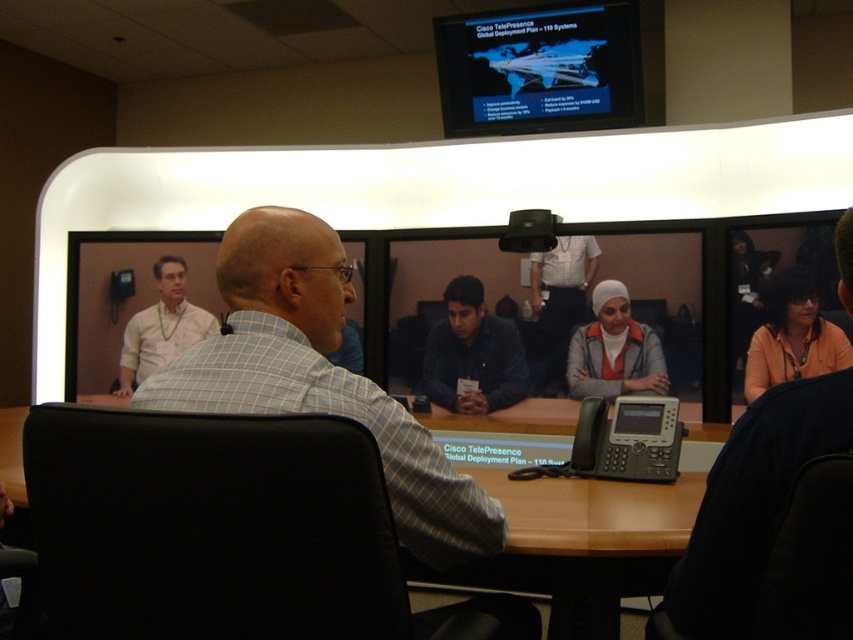
You are a virtual assistant navigating a video call interface. You need to determine which of the two points, point [114,392] or point [527,225], is closer to the camera. Which point is closer?

Point [114,392] is closer to the camera than point [527,225] because it is further to the viewer according to the description.

You are a remote participant in a video call. You see a point marked at coordinates (792,337) on your screen. What object is located at this point?

The orange fabric shirt at lower right is located at point (792,337).

You are a video conferencing technician and need to adjust the camera angle to focus on the orange fabric shirt at lower right. What coordinates should you set the camera to aim at?

The orange fabric shirt at lower right is located at coordinates point (792, 337), so you should set the camera to aim at those coordinates to focus on it.